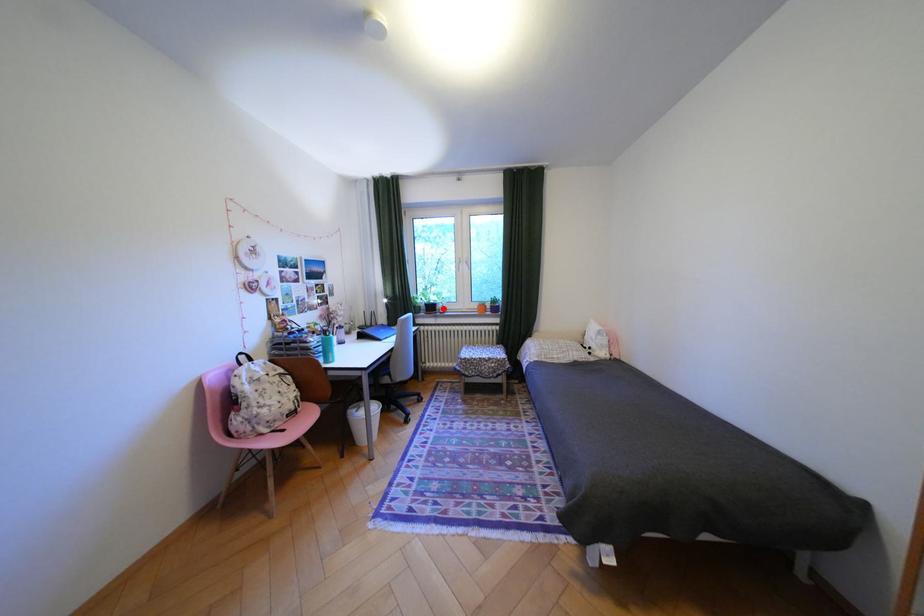
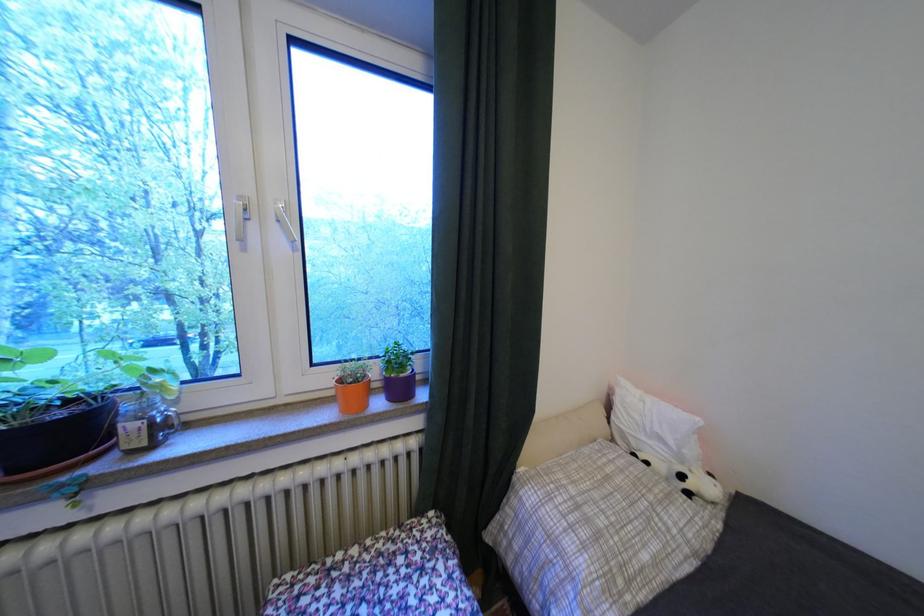
Locate, in the second image, the point that corresponds to the highlighted location in the first image.

(75, 436)